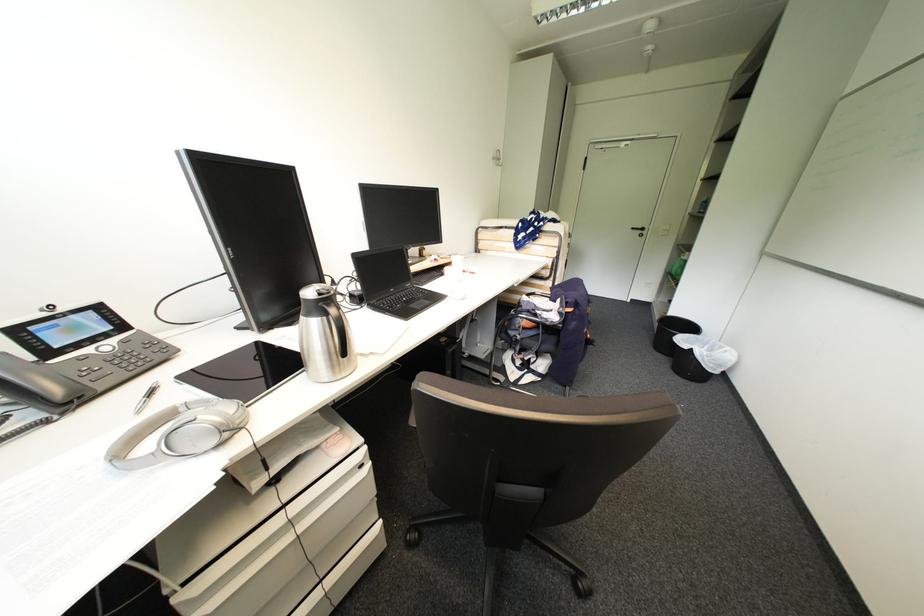
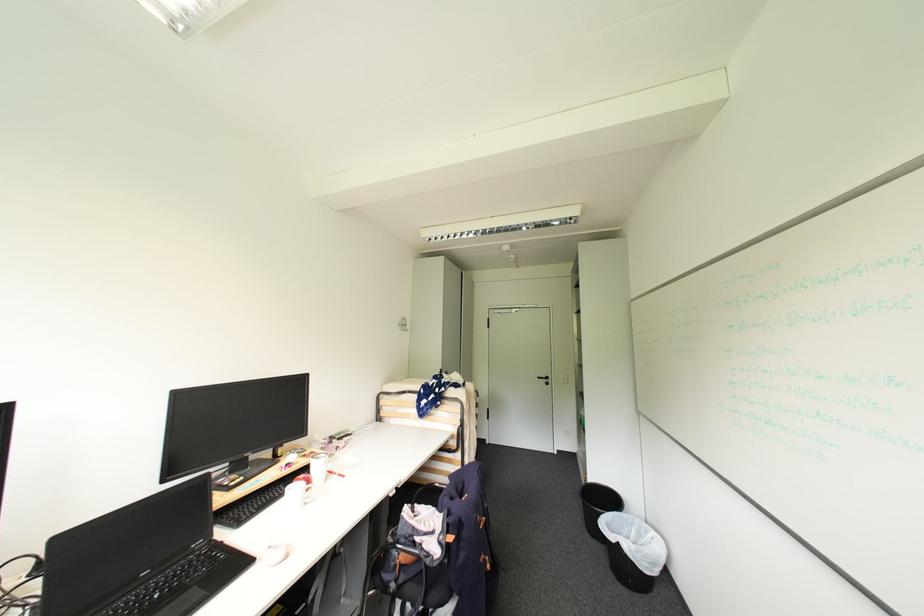
In the second image, find the point that corresponds to (x=397, y=291) in the first image.

(150, 575)